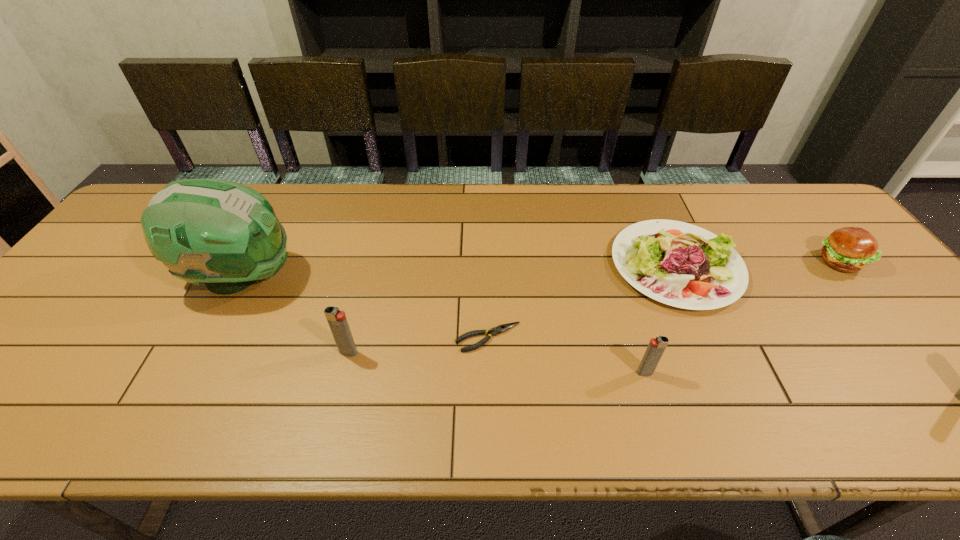
In the image, there is a desktop. Find the location of `vacant space at the far edge`. vacant space at the far edge is located at coordinates (445, 230).

Where is `vacant space at the near edge of the desktop`? The height and width of the screenshot is (540, 960). vacant space at the near edge of the desktop is located at coordinates (108, 380).

This screenshot has width=960, height=540. Find the location of `vacant space at the left edge of the desktop`. vacant space at the left edge of the desktop is located at coordinates (84, 289).

In the image, there is a desktop. Where is `vacant space at the right edge`? The image size is (960, 540). vacant space at the right edge is located at coordinates pyautogui.click(x=919, y=346).

You are a GUI agent. You are given a task and a screenshot of the screen. Output one action in this format:
    pyautogui.click(x=<x>, y=<y>)
    Task: Click on the blank space at the far right corner
    This screenshot has width=960, height=540.
    Given the screenshot: What is the action you would take?
    pyautogui.click(x=794, y=214)

Where is `empty space between the nearer igniter and the second shortest object`? empty space between the nearer igniter and the second shortest object is located at coordinates (660, 319).

Find the location of a particular element. Image resolution: width=960 pixels, height=540 pixels. unoccupied position between the hamburger and the right igniter is located at coordinates (742, 317).

Where is `vacant area that lies between the salad plate and the leftmost object`? The image size is (960, 540). vacant area that lies between the salad plate and the leftmost object is located at coordinates (459, 271).

Locate an element on the screen. This screenshot has width=960, height=540. vacant space in between the fifth tallest object and the third tallest object is located at coordinates (660, 319).

Where is `blank region between the shorter igniter and the football helmet`? The height and width of the screenshot is (540, 960). blank region between the shorter igniter and the football helmet is located at coordinates (444, 325).